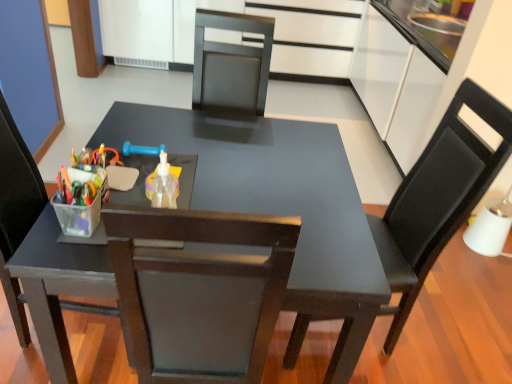
The height and width of the screenshot is (384, 512). I want to click on vacant area situated to the left side of translucent plastic bottle at center, so click(114, 200).